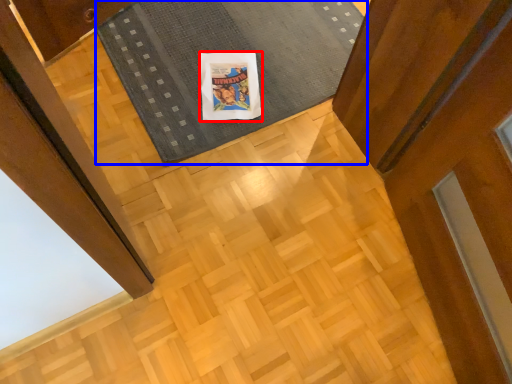
Question: Which point is closer to the camera, comic book character (highlighted by a red box) or mat (highlighted by a blue box)?

Choices:
 (A) comic book character
 (B) mat

Answer: (B)